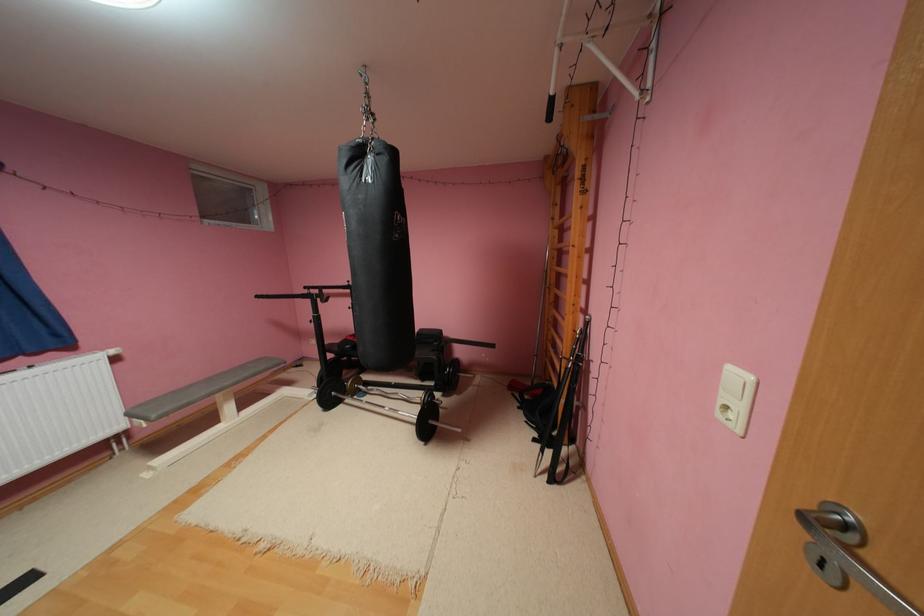
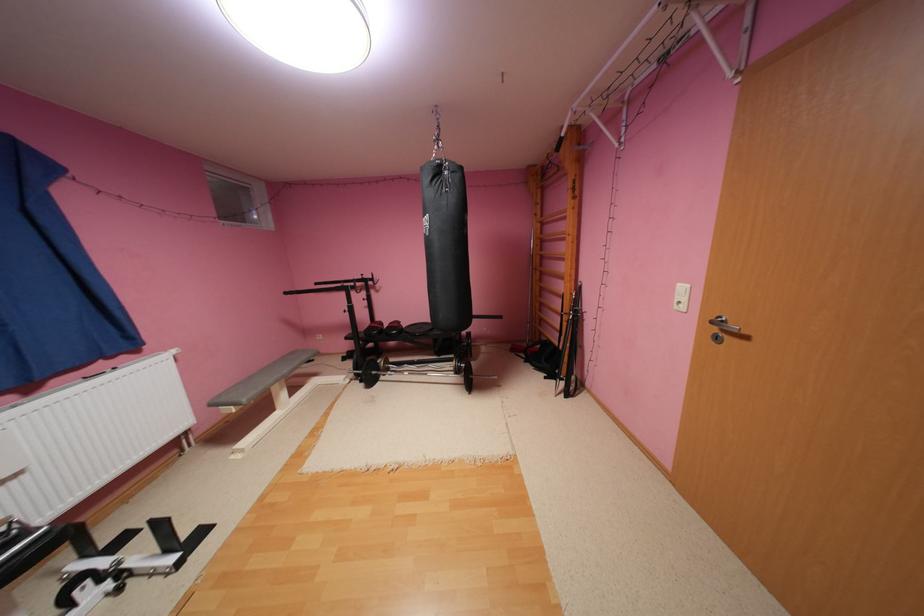
In the second image, find the point that corresponds to pixel 368 153 in the first image.

(446, 171)